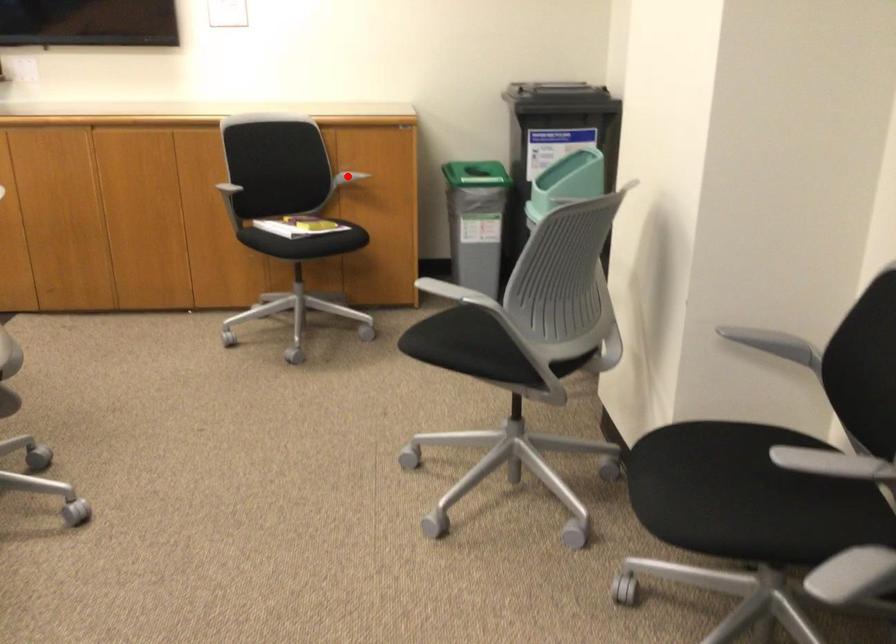
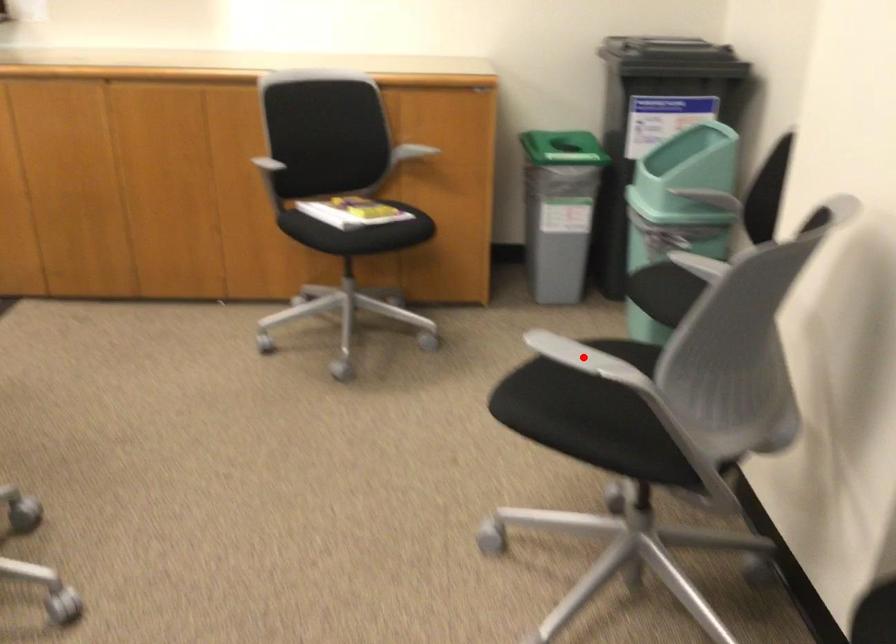
I am providing you with two images of the same scene from different viewpoints. A red point is marked on the first image and another point is marked on the second image. Is the marked point in image1 the same physical position as the marked point in image2?

No